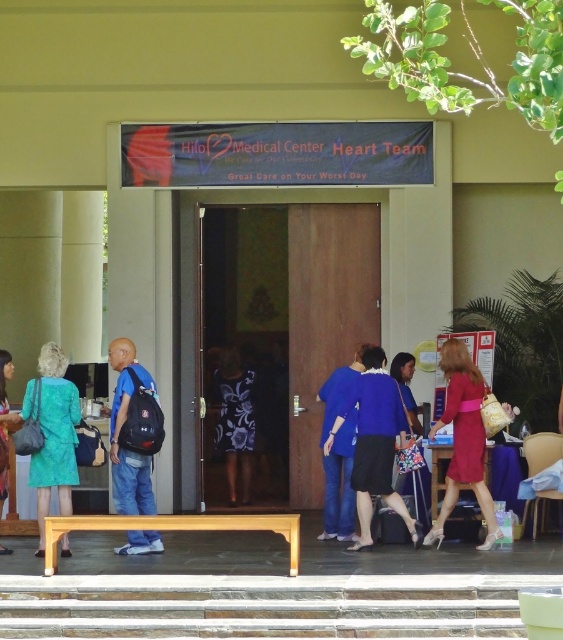
You are standing at the entrance of Hilo Medical Center Heart Team and see two points marked on the ground. One is labeled as point (288, 588) and the other as point (337, 440). Which point is closer to the entrance?

Result: Point (288, 588) is in front of point (337, 440), so it is closer to the entrance.